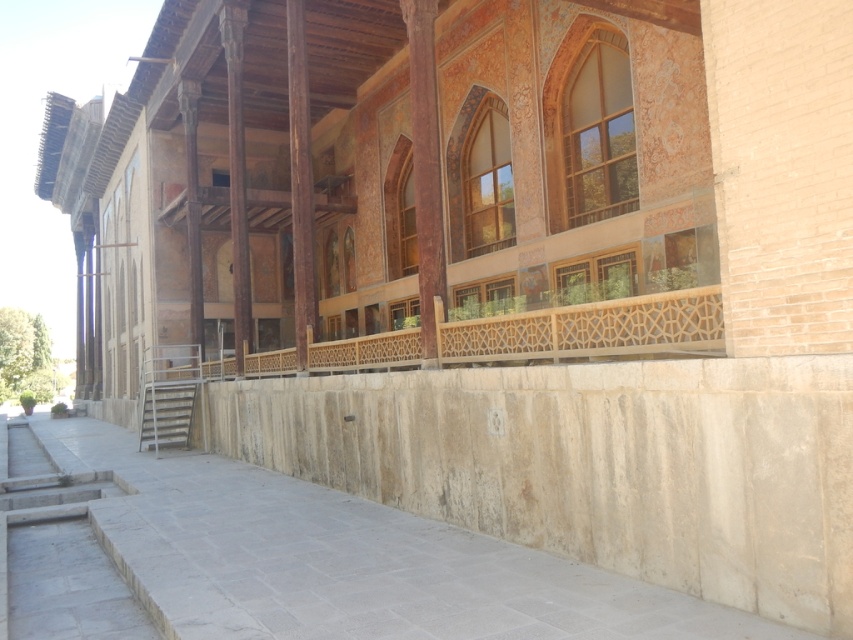
You are a maintenance worker needing to replace a loose tile between the wooden lattice balustrade at center and the matte brown pillar at center. You have a 10 feet long ladder. Can you safely reach the gap between them to perform the repair?

Result: The distance between the wooden lattice balustrade at center and the matte brown pillar at center is 9.28 feet. Since the ladder is 10 feet long, it is long enough to safely bridge the gap and allow you to reach the area for repair.

You are standing in front of the building and want to reach a decorative element located at point (589, 330). What is the name of the object at that coordinate?

The object at point (589, 330) is the wooden lattice balustrade at center.